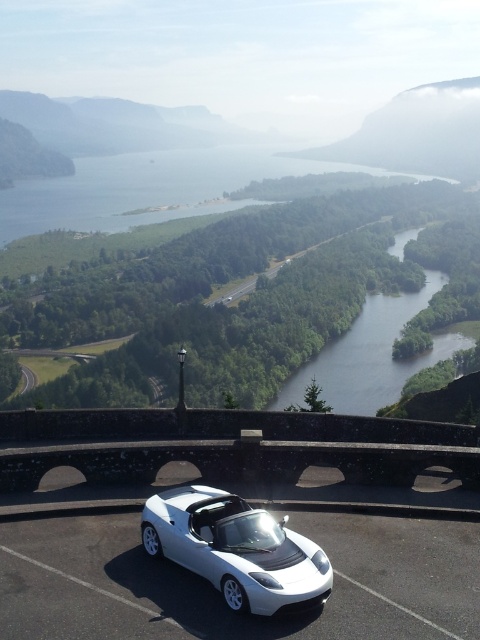
You are planning to take a photo of the white glossy car at center and the blue water at center from the overlook. Which object will appear wider in the photo?

The blue water at center will appear wider in the photo because its width is larger than that of the white glossy car at center.

You are a photographer standing at the overlook. You want to take a photo that includes both the white glossy car at center and the green smooth water at center. Which object will appear larger in the photo?

The white glossy car at center will appear larger in the photo because it is closer to the viewer than the green smooth water at center.